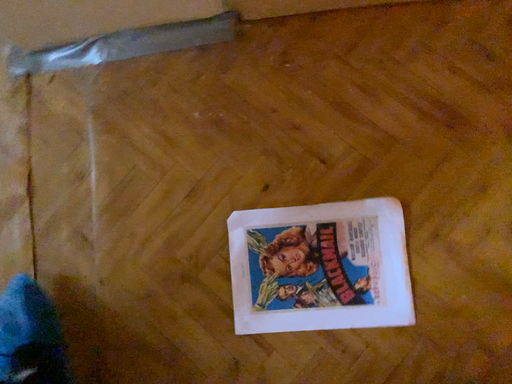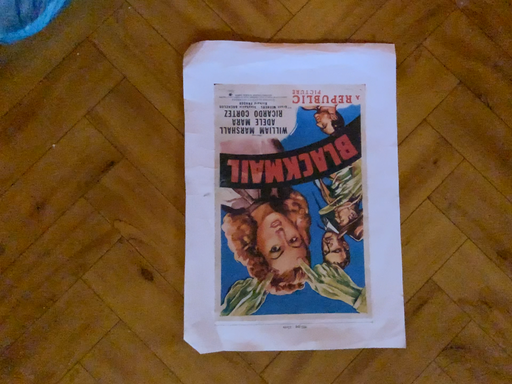
Question: How did the camera likely rotate when shooting the video?

Choices:
 (A) rotated right
 (B) rotated left

Answer: (A)